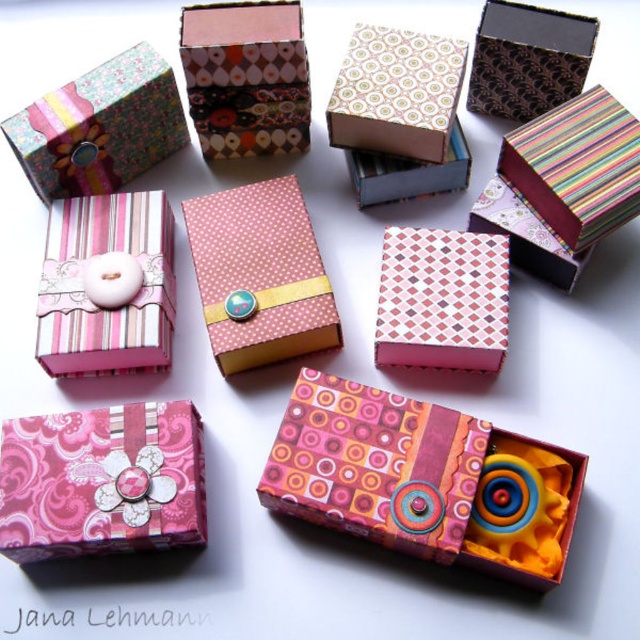
Measure the distance between pink dotted paper gift box at center and patterned paper gift box at upper center.

The distance of pink dotted paper gift box at center from patterned paper gift box at upper center is 8.19 inches.

Between pink dotted paper gift box at center and patterned paper gift box at upper center, which one appears on the left side from the viewer's perspective?

From the viewer's perspective, patterned paper gift box at upper center appears more on the left side.

Who is more distant from viewer, (x=228, y=282) or (x=244, y=83)?

Positioned behind is point (x=244, y=83).

The image size is (640, 640). Find the location of `pink dotted paper gift box at center`. pink dotted paper gift box at center is located at coordinates (260, 275).

Is point (61, 147) closer to camera compared to point (246, 26)?

No, it is not.

Between matte pink paper gift box at upper left and patterned paper gift box at upper center, which one appears on the left side from the viewer's perspective?

matte pink paper gift box at upper left

Locate an element on the screen. matte pink paper gift box at upper left is located at coordinates (99, 125).

Is patterned paper gift box at center thinner than matte brown gift box at upper right?

No.

Image resolution: width=640 pixels, height=640 pixels. Describe the element at coordinates (374, 465) in the screenshot. I see `patterned paper gift box at center` at that location.

What are the coordinates of `patterned paper gift box at center` in the screenshot? It's located at (374, 465).

Where is `patterned paper gift box at center`? The image size is (640, 640). patterned paper gift box at center is located at coordinates (374, 465).